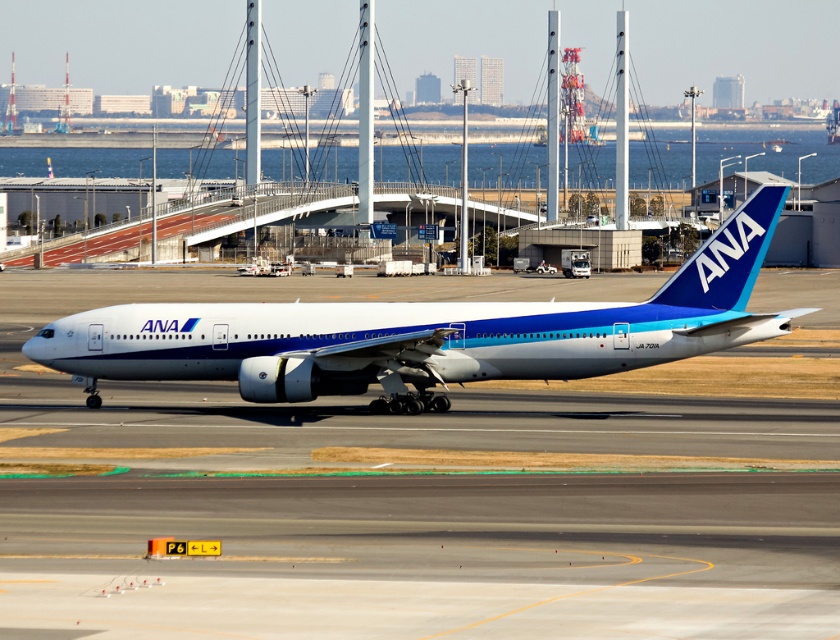
Question: Is white smooth tarmac at center to the left of white glossy airplane at center from the viewer's perspective?

Choices:
 (A) no
 (B) yes

Answer: (A)

Question: Which point is farther to the camera?

Choices:
 (A) white glossy airplane at center
 (B) white smooth tarmac at center

Answer: (A)

Question: Which point is farther to the camera?

Choices:
 (A) (445, 372)
 (B) (365, 474)

Answer: (A)

Question: Is white smooth tarmac at center below white glossy airplane at center?

Choices:
 (A) yes
 (B) no

Answer: (B)

Question: Where is white smooth tarmac at center located in relation to white glossy airplane at center in the image?

Choices:
 (A) above
 (B) below

Answer: (A)